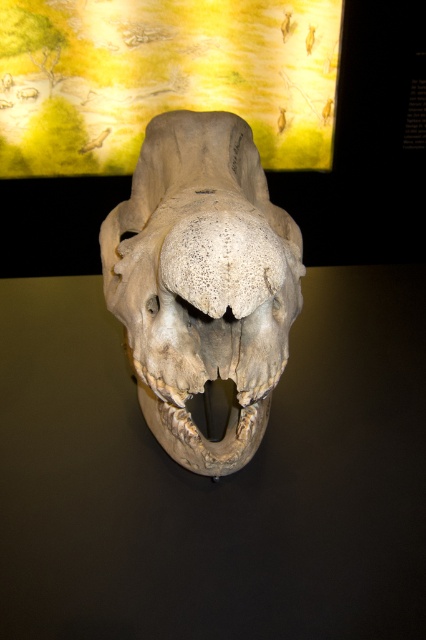
You are a museum visitor who wants to take a photo of the transparent glass skull at center and the gray textured skull at center. Which one will appear taller in the photo?

The gray textured skull at center will appear taller in the photo because the transparent glass skull at center is not as tall as it.

You are a museum visitor standing in front of the display. You see the transparent glass skull at center and the gray textured skull at center. Which one is located to the left?

The transparent glass skull at center is positioned to the left of the gray textured skull at center.

You are a museum visitor holding a flashlight. You want to see the details of both the transparent glass skull at center and the gray textured skull at center. Which one will allow you to see through to the other side?

The transparent glass skull at center allows you to see through to the other side because it is made of transparent glass, unlike the gray textured skull at center which is solid.